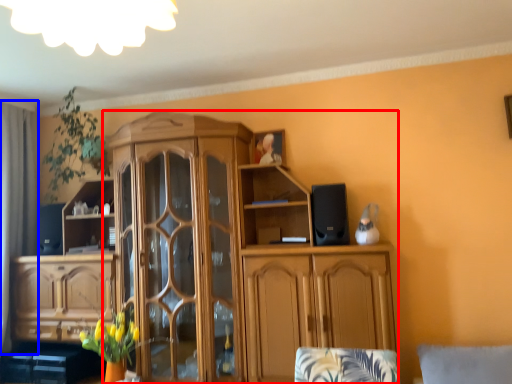
Question: Which object appears farthest to the camera in this image, cabinetry (highlighted by a red box) or curtain (highlighted by a blue box)?

Choices:
 (A) cabinetry
 (B) curtain

Answer: (B)